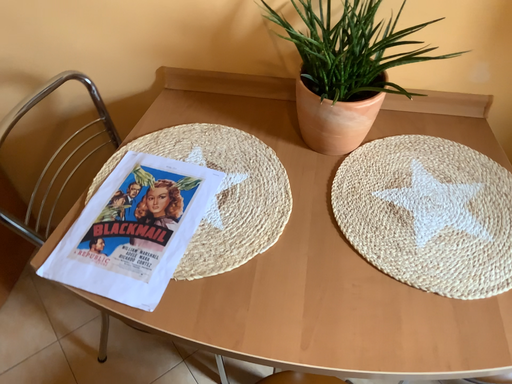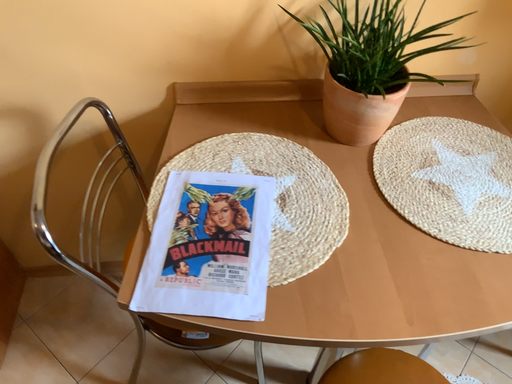
Question: How did the camera likely rotate when shooting the video?

Choices:
 (A) rotated right
 (B) rotated left

Answer: (A)